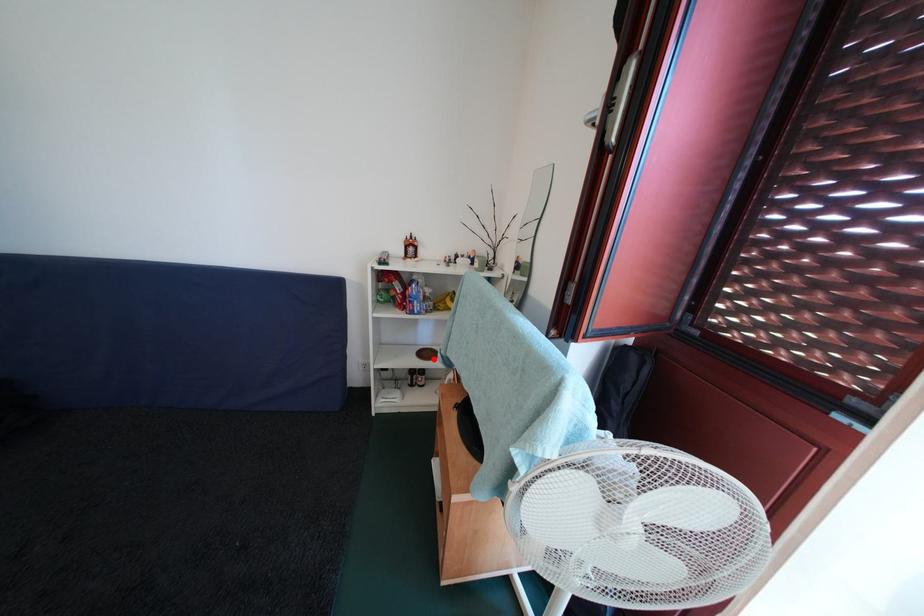
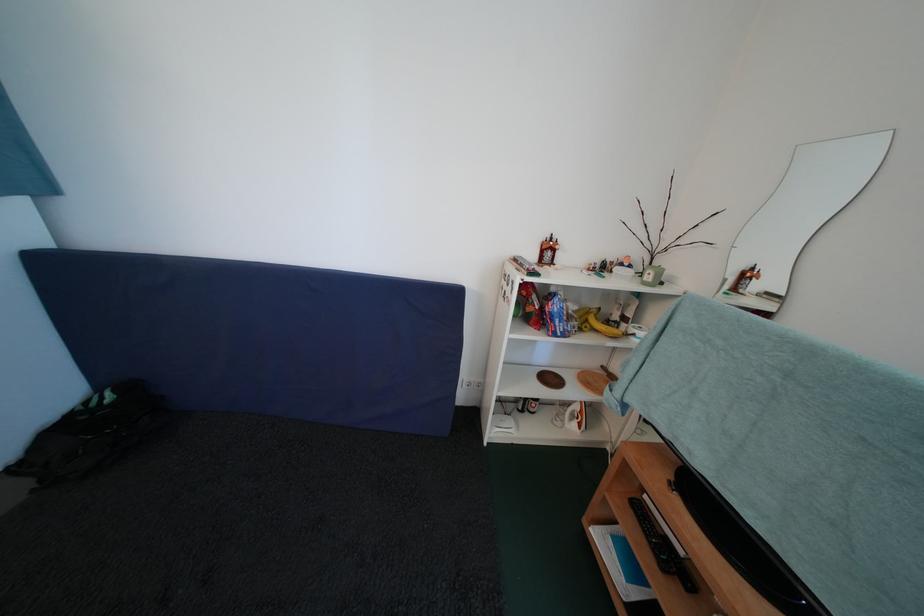
Question: I am providing you with two images of the same scene from different viewpoints. A red point is marked on the first image. At the location where the point appears in image 1, is it still visible in image 2?

Choices:
 (A) Yes
 (B) No

Answer: (A)